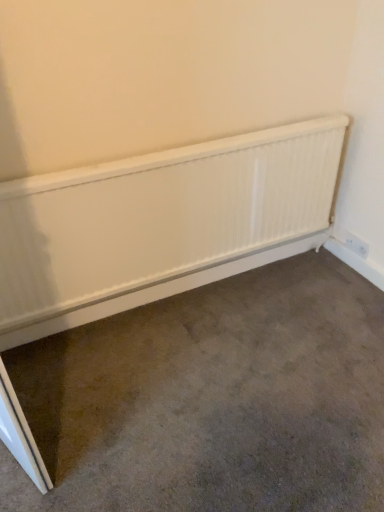
Where is `white plastic electric outlet at lower right`? The height and width of the screenshot is (512, 384). white plastic electric outlet at lower right is located at coordinates (356, 245).

This screenshot has width=384, height=512. Describe the element at coordinates (356, 245) in the screenshot. I see `white plastic electric outlet at lower right` at that location.

Where is `white matte radiator at center`? The width and height of the screenshot is (384, 512). white matte radiator at center is located at coordinates (213, 399).

Where is `white plastic electric outlet at lower right`? This screenshot has width=384, height=512. white plastic electric outlet at lower right is located at coordinates (356, 245).

Is white matte radiator at center facing away from white textured radiator at center?

white matte radiator at center is not turned away from white textured radiator at center.

In the scene shown: How far apart are white matte radiator at center and white textured radiator at center?

A distance of 19.18 inches exists between white matte radiator at center and white textured radiator at center.

Looking at this image, does white matte radiator at center appear on the right side of white textured radiator at center?

Correct, you'll find white matte radiator at center to the right of white textured radiator at center.

There is a white matte radiator at center. Where is `radiator above it (from a real-world perspective)`? radiator above it (from a real-world perspective) is located at coordinates (160, 224).

Looking at this image, is white matte radiator at center oriented towards white plastic electric outlet at lower right?

No.

Where is `electric outlet that appears above the white matte radiator at center (from the image's perspective)`? The height and width of the screenshot is (512, 384). electric outlet that appears above the white matte radiator at center (from the image's perspective) is located at coordinates (356, 245).

Considering the sizes of objects white matte radiator at center and white plastic electric outlet at lower right in the image provided, who is thinner, white matte radiator at center or white plastic electric outlet at lower right?

white plastic electric outlet at lower right is thinner.

How many degrees apart are the facing directions of white matte radiator at center and white plastic electric outlet at lower right?

There is a 89.4-degree angle between the facing directions of white matte radiator at center and white plastic electric outlet at lower right.

Is white plastic electric outlet at lower right with white matte radiator at center?

white plastic electric outlet at lower right and white matte radiator at center are clearly separated.

Choose the correct answer: Is white plastic electric outlet at lower right inside white matte radiator at center or outside it?

white plastic electric outlet at lower right is located beyond the bounds of white matte radiator at center.

Consider the image. Considering their positions, is white plastic electric outlet at lower right located in front of or behind white matte radiator at center?

white plastic electric outlet at lower right is behind white matte radiator at center.

From the picture: From a real-world perspective, relative to white matte radiator at center, is white textured radiator at center vertically above or below?

white textured radiator at center is above white matte radiator at center.

Looking at their sizes, would you say white textured radiator at center is wider or thinner than white matte radiator at center?

In the image, white textured radiator at center appears to be more narrow than white matte radiator at center.

From the image's perspective, is white textured radiator at center under white matte radiator at center?

Actually, white textured radiator at center appears above white matte radiator at center in the image.

Can you confirm if white textured radiator at center is taller than white plastic electric outlet at lower right?

Correct, white textured radiator at center is much taller as white plastic electric outlet at lower right.

Is white textured radiator at center looking in the opposite direction of white plastic electric outlet at lower right?

No.

Does point (56, 188) appear closer or farther from the camera than point (351, 249)?

Point (56, 188) is positioned closer to the camera compared to point (351, 249).

Where is `electric outlet located behind the white textured radiator at center`? This screenshot has width=384, height=512. electric outlet located behind the white textured radiator at center is located at coordinates (356, 245).

Is white plastic electric outlet at lower right positioned in front of white textured radiator at center?

That is False.

Consider the image. From the image's perspective, would you say white plastic electric outlet at lower right is positioned over white textured radiator at center?

Actually, white plastic electric outlet at lower right appears below white textured radiator at center in the image.

Is white textured radiator at center at the back of white plastic electric outlet at lower right?

That's not correct — white plastic electric outlet at lower right is not looking away from white textured radiator at center.

In the image, there is a white textured radiator at center. Identify the location of concrete below it (from a real-world perspective). (213, 399).

Locate an element on the screen. Image resolution: width=384 pixels, height=512 pixels. electric outlet located behind the white matte radiator at center is located at coordinates (356, 245).

Which object lies nearer to the anchor point white matte radiator at center, white textured radiator at center or white plastic electric outlet at lower right?

white textured radiator at center lies closer to white matte radiator at center than the other object.

Considering their positions, is white matte radiator at center positioned further to white plastic electric outlet at lower right than white textured radiator at center?

white matte radiator at center is positioned further to the anchor white plastic electric outlet at lower right.

Considering their positions, is white matte radiator at center positioned closer to white textured radiator at center than white plastic electric outlet at lower right?

The object closer to white textured radiator at center is white matte radiator at center.

When comparing their distances from white textured radiator at center, does white plastic electric outlet at lower right or white matte radiator at center seem closer?

The object closer to white textured radiator at center is white matte radiator at center.

Which object lies further to the anchor point white matte radiator at center, white plastic electric outlet at lower right or white textured radiator at center?

Based on the image, white plastic electric outlet at lower right appears to be further to white matte radiator at center.

Considering their positions, is white textured radiator at center positioned further to white plastic electric outlet at lower right than white matte radiator at center?

white matte radiator at center is further to white plastic electric outlet at lower right.

Identify the location of radiator between white matte radiator at center and white plastic electric outlet at lower right in the front-back direction. The image size is (384, 512). tap(160, 224).